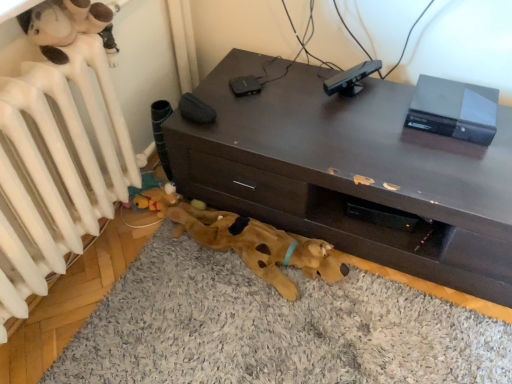
Find the location of a particular element. This screenshot has height=384, width=512. empty space that is ontop of brown plush dog bed at lower center (from a real-world perspective) is located at coordinates (275, 318).